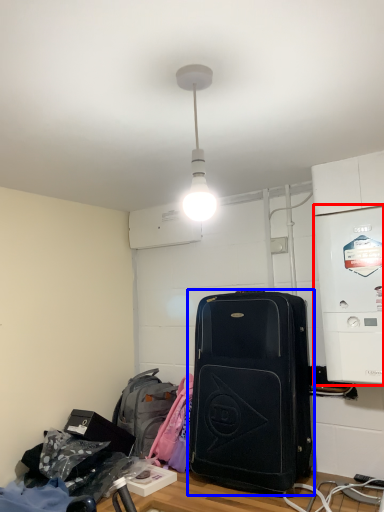
Question: Which object is closer to the camera taking this photo, appliance (highlighted by a red box) or luggage and bags (highlighted by a blue box)?

Choices:
 (A) appliance
 (B) luggage and bags

Answer: (A)